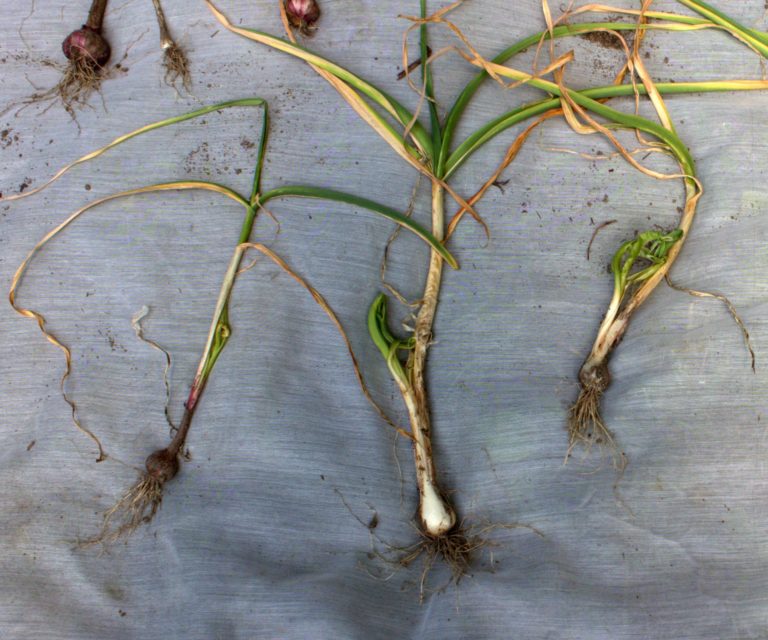
Locate an element on the screen. bulb is located at coordinates (593, 378).